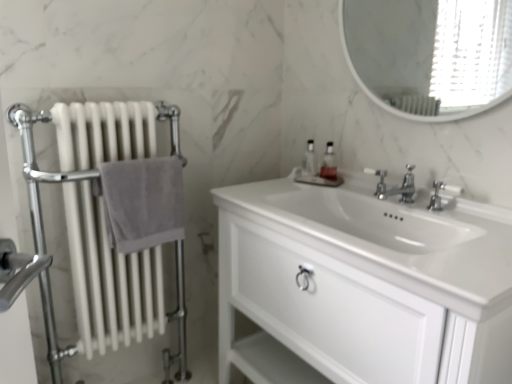
This screenshot has height=384, width=512. What are the coordinates of `vacant area that lies to the right of translucent plastic soap dispenser at center, the 2th soap dispenser when ordered from left to right` in the screenshot? It's located at (358, 185).